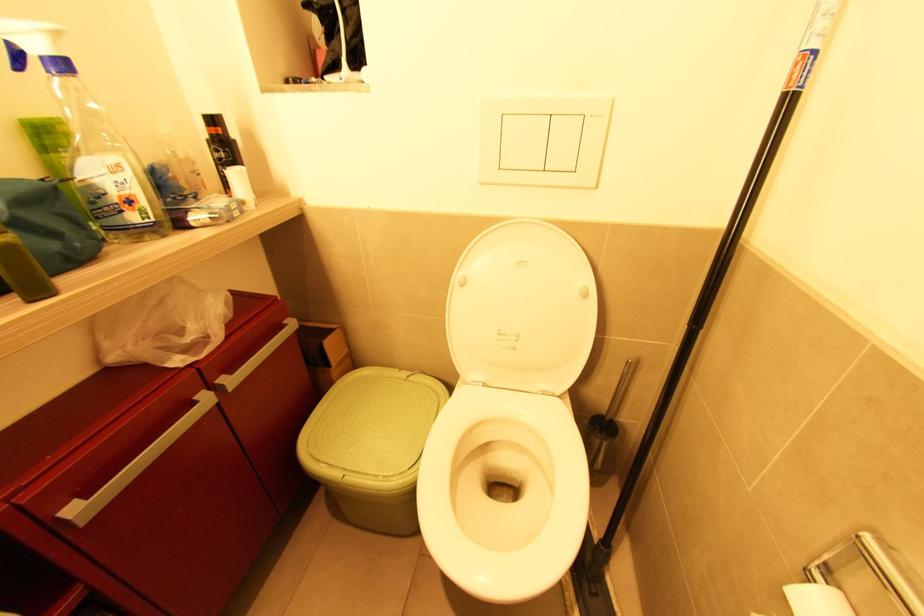
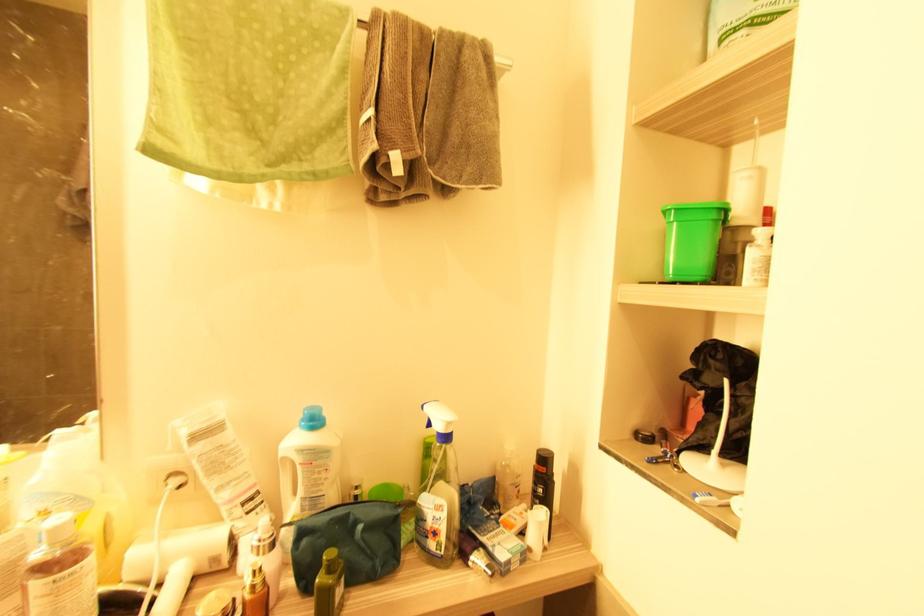
Find the pixel in the second image that matches point 66,69 in the first image.

(447, 438)